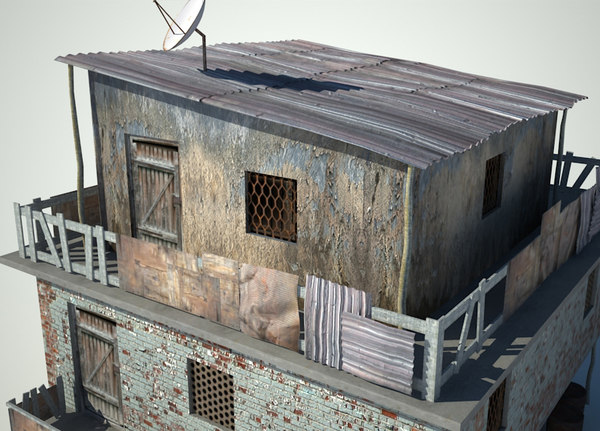
The image size is (600, 431). In order to click on door in this screenshot , I will do `click(143, 203)`.